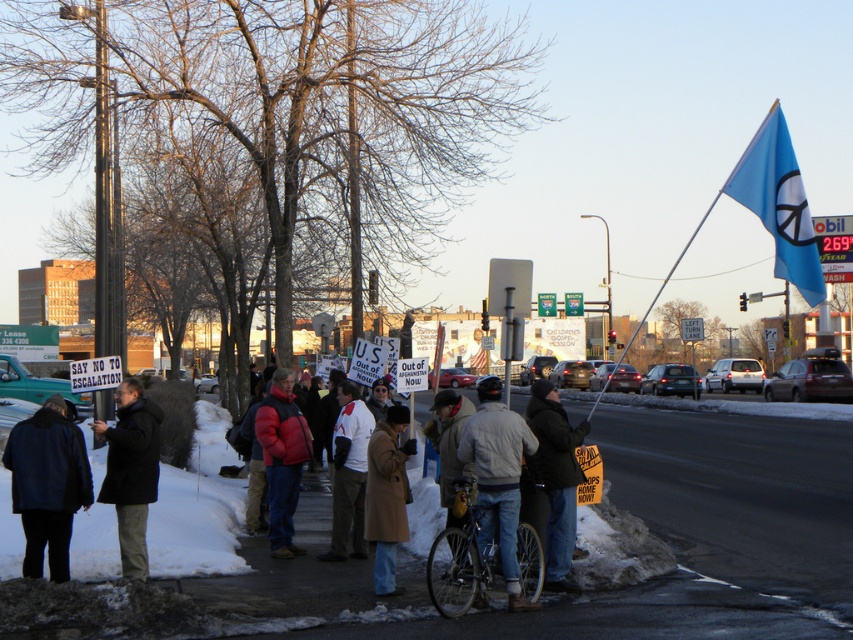
Question: Among these points, which one is nearest to the camera?

Choices:
 (A) (393, 435)
 (B) (140, 561)
 (C) (274, 378)

Answer: (B)

Question: Is metallic silver bicycle at center closer to the viewer compared to red puffy jacket at center?

Choices:
 (A) no
 (B) yes

Answer: (B)

Question: From the image, what is the correct spatial relationship of black wool coat at lower left in relation to red jacket at center?

Choices:
 (A) left
 (B) right

Answer: (A)

Question: Can you confirm if dark blue jacket at lower left is positioned to the left of denim jacket at center?

Choices:
 (A) yes
 (B) no

Answer: (A)

Question: Which point appears closest to the camera in this image?

Choices:
 (A) (358, 486)
 (B) (558, 410)
 (C) (20, 454)
 (D) (386, 500)

Answer: (C)

Question: Which of these objects is positioned closest to the black leather jacket at center?

Choices:
 (A) snowy asphalt sidewalk at lower left
 (B) metallic silver bicycle at center

Answer: (B)